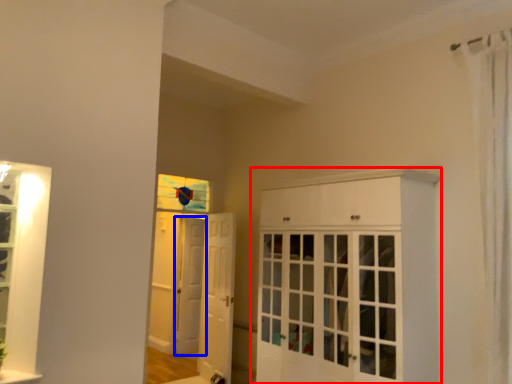
Question: Which of the following is the farthest to the observer, cabinetry (highlighted by a red box) or door (highlighted by a blue box)?

Choices:
 (A) cabinetry
 (B) door

Answer: (B)